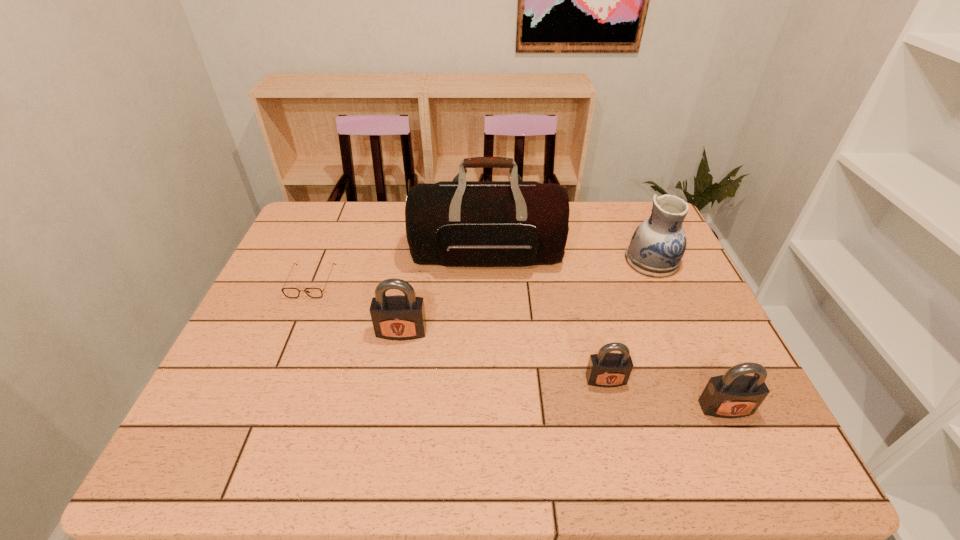
Where is `vacant position located 0.200m on the front of the fourth farthest object near the keyhole`? The width and height of the screenshot is (960, 540). vacant position located 0.200m on the front of the fourth farthest object near the keyhole is located at coordinates (387, 415).

The width and height of the screenshot is (960, 540). Identify the location of free location located 0.340m on the front of the pottery. (706, 380).

Locate an element on the screen. free space located on the front-facing side of the leftmost object is located at coordinates (293, 326).

Where is `free location located on the front pocket of the tallest object`? free location located on the front pocket of the tallest object is located at coordinates [489, 319].

Identify the location of pottery present at the far edge. This screenshot has height=540, width=960. click(657, 246).

Where is `duffel bag that is positioned at the far edge`? duffel bag that is positioned at the far edge is located at coordinates (459, 223).

Locate an element on the screen. This screenshot has height=540, width=960. object that is at the left edge is located at coordinates (288, 292).

Locate an element on the screen. padlock that is at the right edge is located at coordinates (733, 395).

What are the coordinates of `pottery at the right edge` in the screenshot? It's located at (657, 246).

Identify the location of object that is at the far right corner. The height and width of the screenshot is (540, 960). pyautogui.click(x=657, y=246).